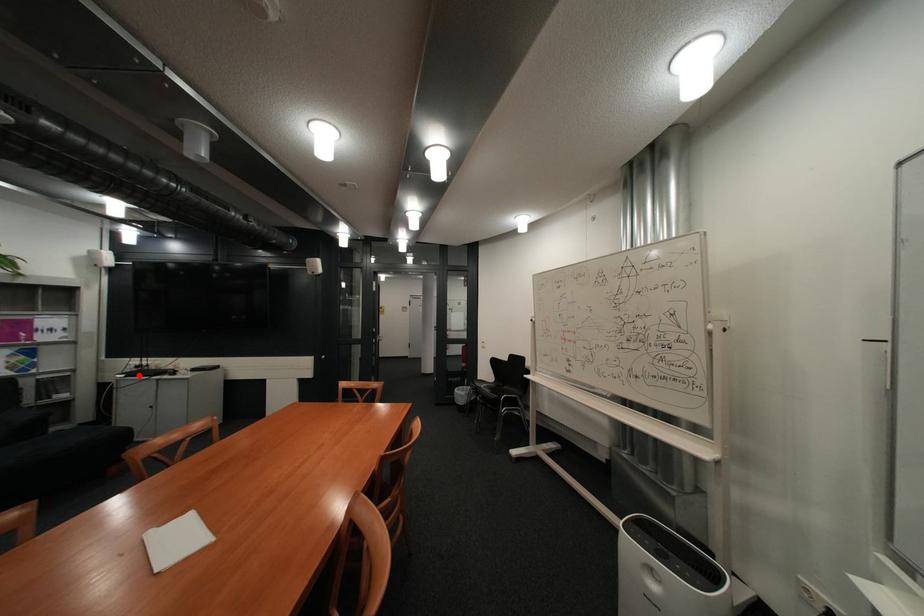
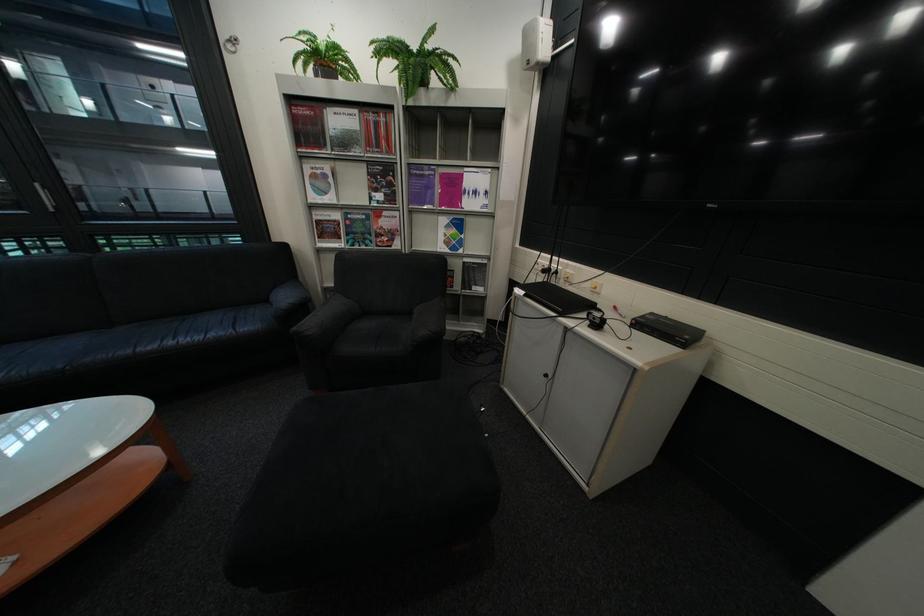
In the second image, find the point that corresponds to the highlighted location in the first image.

(538, 293)